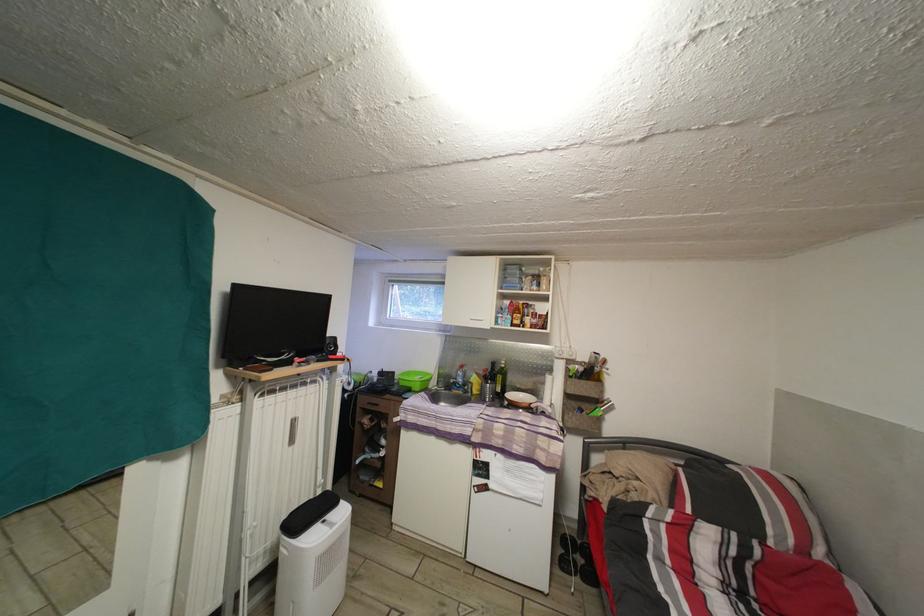
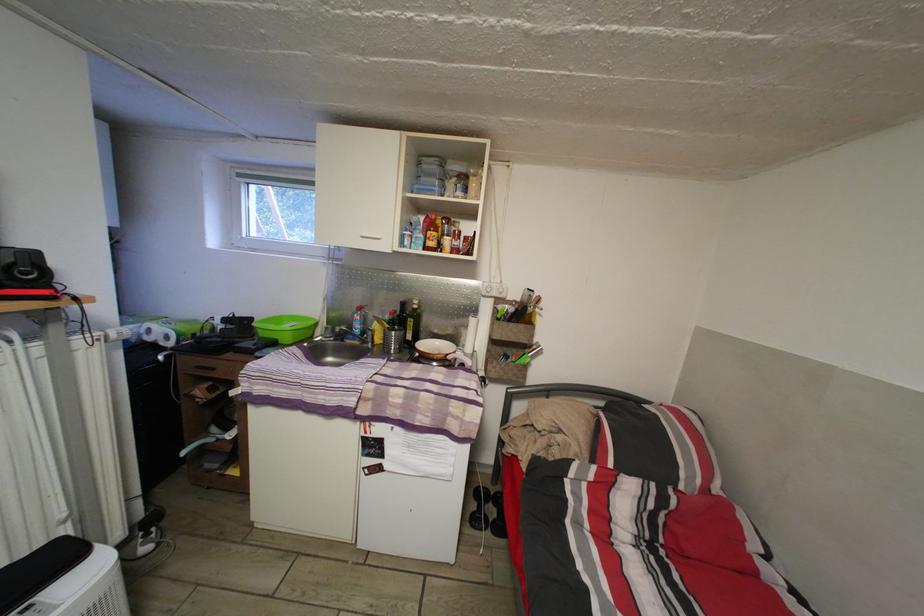
Find the pixel in the second image that matches [505,397] in the first image.

(417, 344)